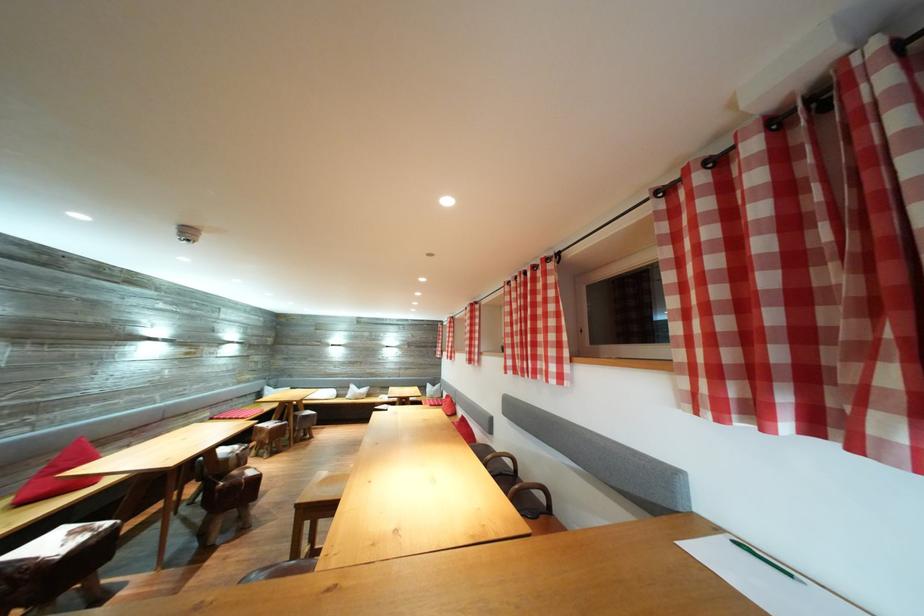
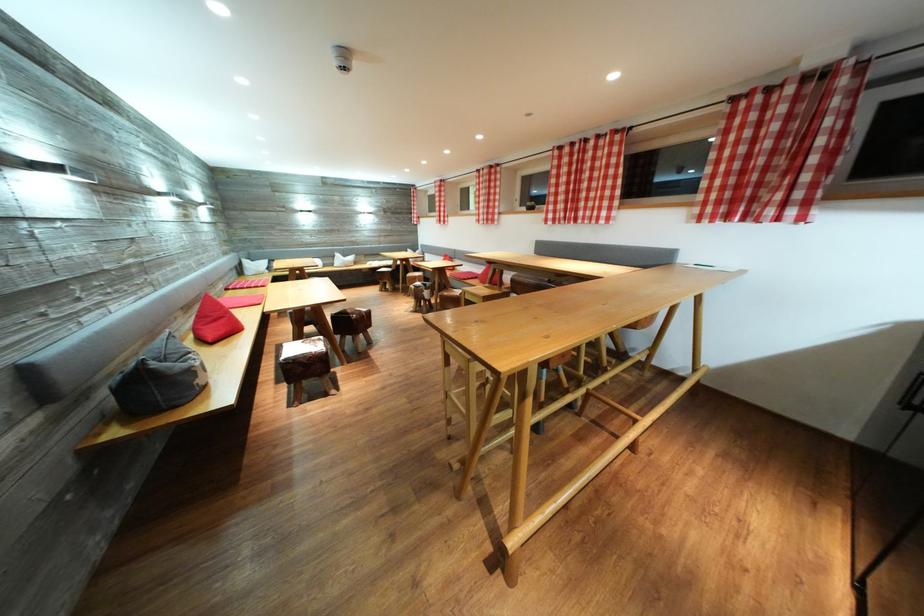
Find the pixel in the second image that matches (227,495) in the first image.

(362, 325)